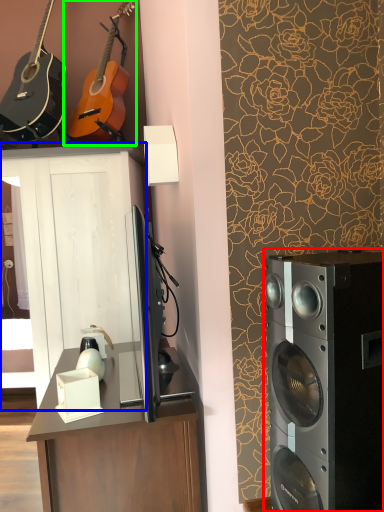
Question: Which is nearer to the home appliance (highlighted by a red box)? cabinetry (highlighted by a blue box) or guitar (highlighted by a green box).

Choices:
 (A) cabinetry
 (B) guitar

Answer: (A)